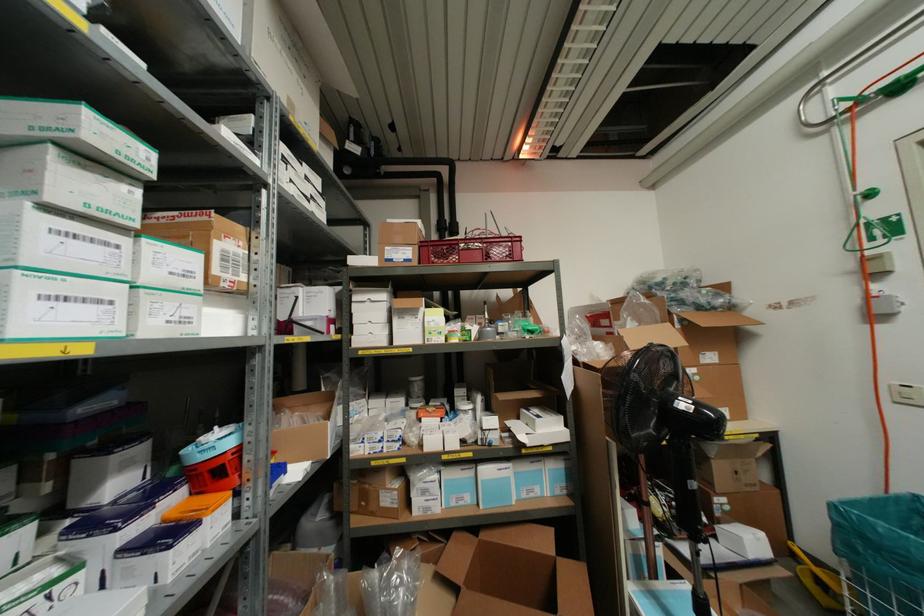
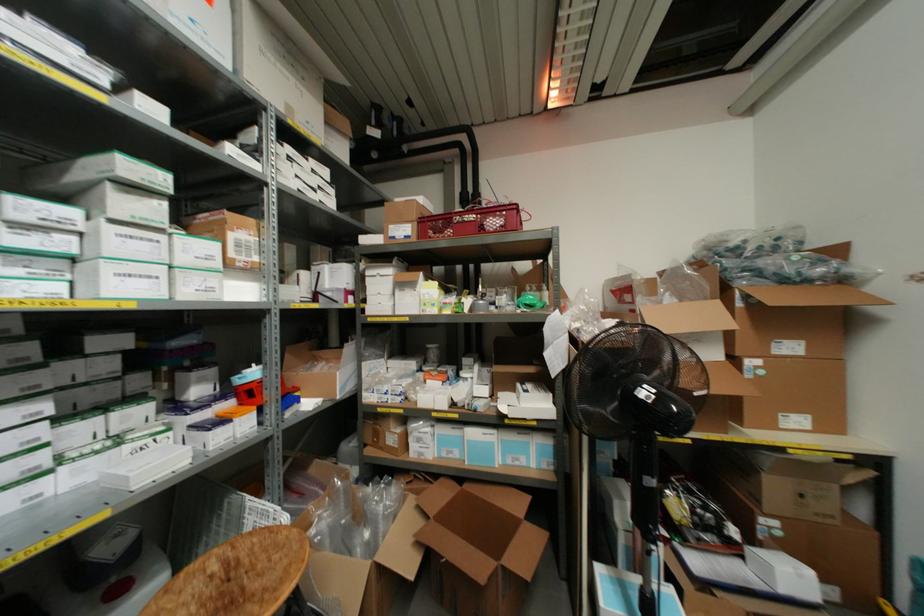
Question: Based on the continuous images, in which direction is the camera rotating? Reply with the corresponding letter.

Choices:
 (A) Left
 (B) Right
 (C) Up
 (D) Down

Answer: (A)